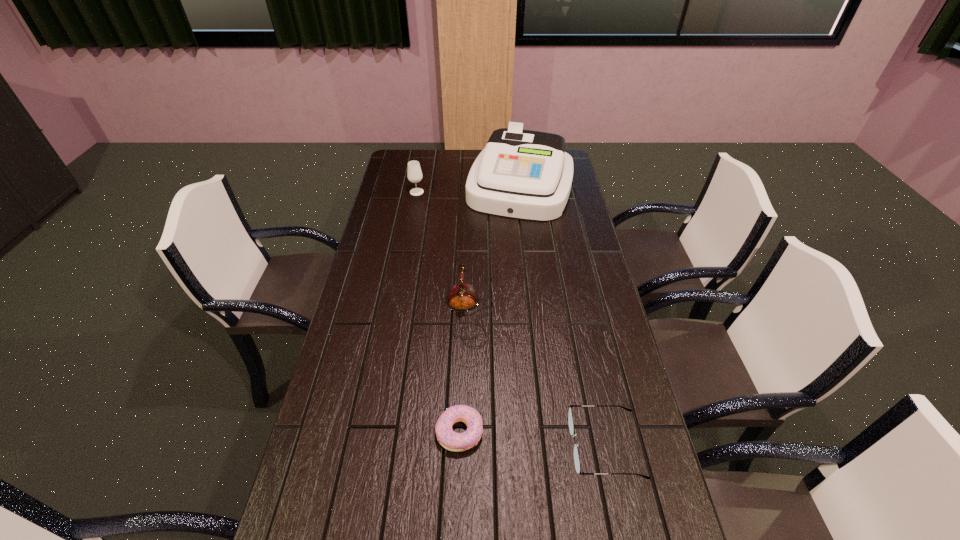
At what (x,y) coordinates should I click in order to perform the action: click on the fourth closest object to the shortest object. Please return your answer as a coordinate pair (x, y). Image resolution: width=960 pixels, height=540 pixels. Looking at the image, I should click on (414, 173).

Select which object is the fourth closest to the cash register. Please provide its 2D coordinates. Your answer should be formatted as a tuple, i.e. [(x, y)], where the tuple contains the x and y coordinates of a point satisfying the conditions above.

[(570, 417)]